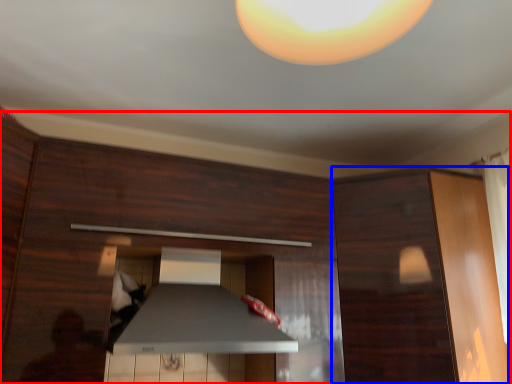
Question: Which of the following is the farthest to the observer, dresser (highlighted by a red box) or cabinetry (highlighted by a blue box)?

Choices:
 (A) dresser
 (B) cabinetry

Answer: (B)